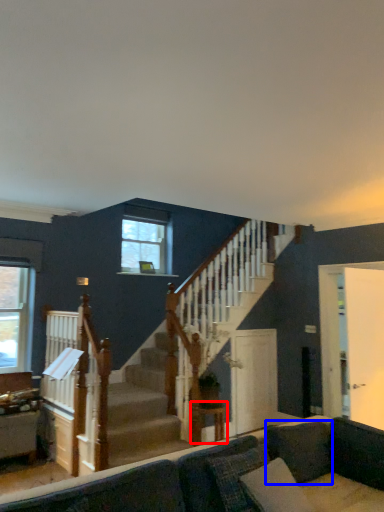
Question: Which of the following is the farthest to the observer, table (highlighted by a red box) or pillow (highlighted by a blue box)?

Choices:
 (A) table
 (B) pillow

Answer: (A)